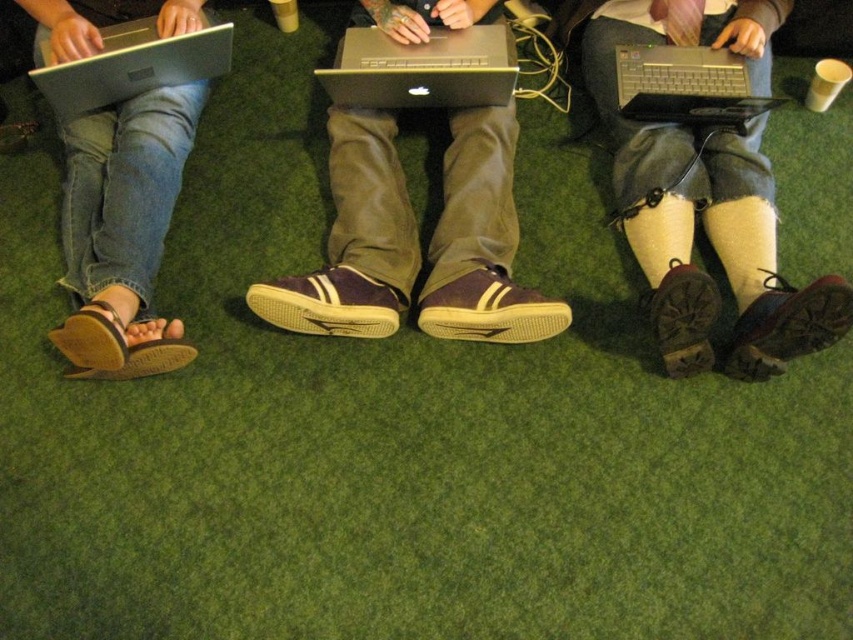
Does silver metallic laptop at left have a lesser width compared to leather boot at lower right?

In fact, silver metallic laptop at left might be wider than leather boot at lower right.

Can you confirm if silver metallic laptop at left is smaller than leather boot at lower right?

Incorrect, silver metallic laptop at left is not smaller in size than leather boot at lower right.

Where is `silver metallic laptop at left`? The height and width of the screenshot is (640, 853). silver metallic laptop at left is located at coordinates (131, 67).

Can you confirm if brown suede shoe at lower right is smaller than brown leather sandal at lower left?

Yes.

Who is lower down, brown suede shoe at lower right or brown leather sandal at lower left?

Positioned lower is brown leather sandal at lower left.

Who is more forward, (753, 337) or (126, 353)?

Point (126, 353) is more forward.

Image resolution: width=853 pixels, height=640 pixels. Find the location of `brown suede shoe at lower right`. brown suede shoe at lower right is located at coordinates [x=787, y=326].

What do you see at coordinates (787, 326) in the screenshot? I see `brown suede shoe at lower right` at bounding box center [787, 326].

Can you confirm if brown suede shoe at lower right is wider than leather boot at lower right?

Yes.

Is point (827, 280) in front of point (691, 358)?

Yes, it is in front of point (691, 358).

Find the location of a particular element. The image size is (853, 640). brown suede shoe at lower right is located at coordinates (787, 326).